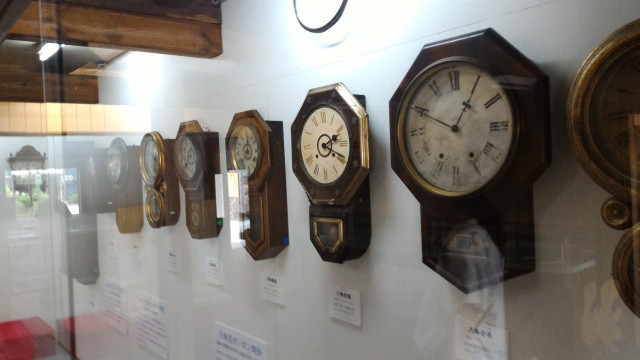
The height and width of the screenshot is (360, 640). I want to click on information card under clock, so click(x=24, y=233), click(x=168, y=254), click(x=129, y=247), click(x=212, y=265), click(x=268, y=278), click(x=340, y=297), click(x=480, y=336).